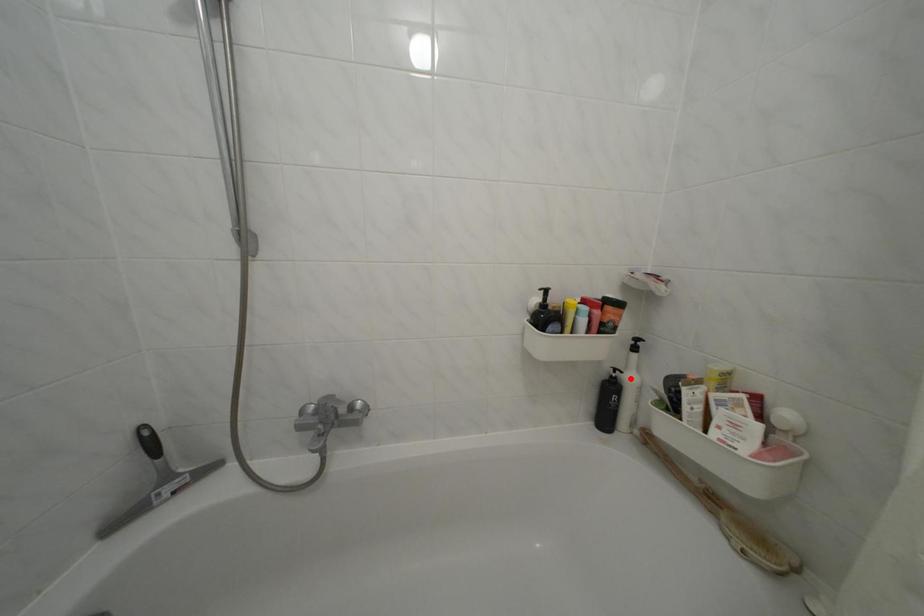
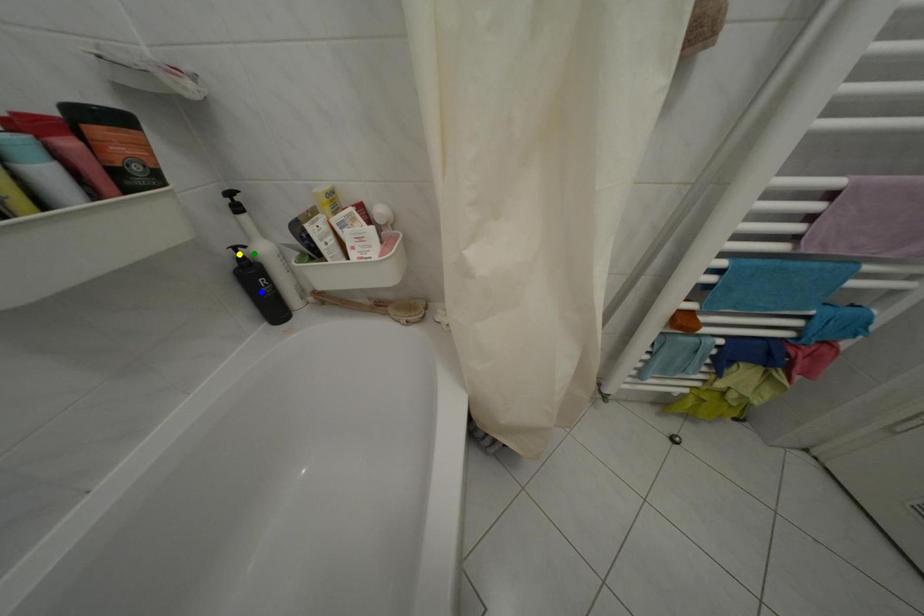
Question: I am providing you with two images of the same scene from different viewpoints. A red point is marked on the first image. You are given multiple points on the second image. Which point in image 2 represents the same 3d spot as the red point in image 1?

Choices:
 (A) green point
 (B) blue point
 (C) yellow point

Answer: (A)